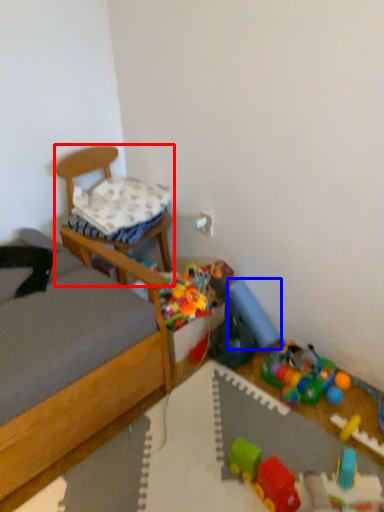
Question: Which object is closer to the camera taking this photo, chair (highlighted by a red box) or toy (highlighted by a blue box)?

Choices:
 (A) chair
 (B) toy

Answer: (A)